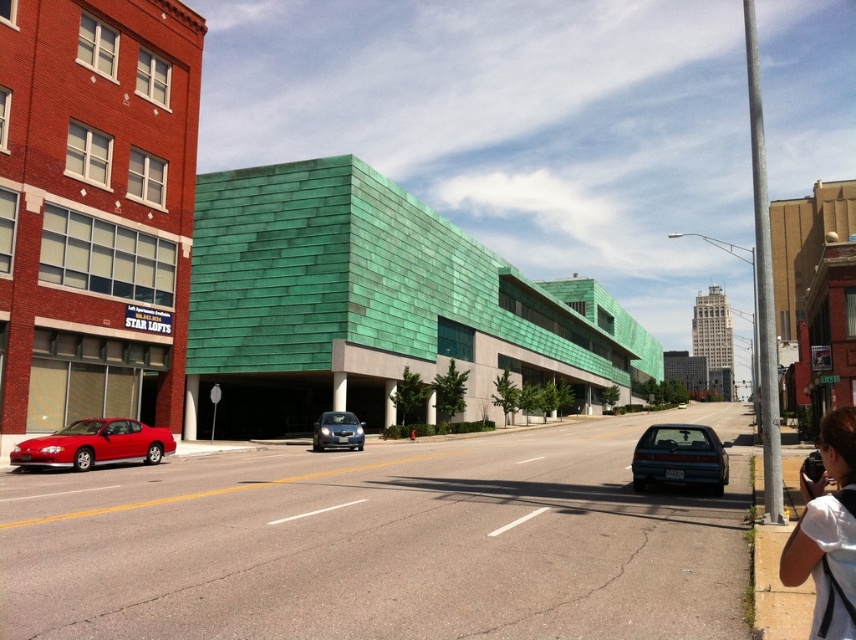
Question: Is matte red car at lower left below satin blue sedan at center?

Choices:
 (A) yes
 (B) no

Answer: (B)

Question: Which object is closer to the camera taking this photo?

Choices:
 (A) matte red car at lower left
 (B) satin blue sedan at center

Answer: (A)

Question: Does teal glossy sedan at lower right appear on the right side of satin blue sedan at center?

Choices:
 (A) yes
 (B) no

Answer: (A)

Question: Which point is farther to the camera?

Choices:
 (A) matte red car at lower left
 (B) white fabric at lower right

Answer: (A)

Question: Which object is the closest to the matte red car at lower left?

Choices:
 (A) satin blue sedan at center
 (B) white fabric at lower right
 (C) teal glossy sedan at lower right

Answer: (A)

Question: Can you confirm if white fabric at lower right is positioned above matte red car at lower left?

Choices:
 (A) no
 (B) yes

Answer: (B)